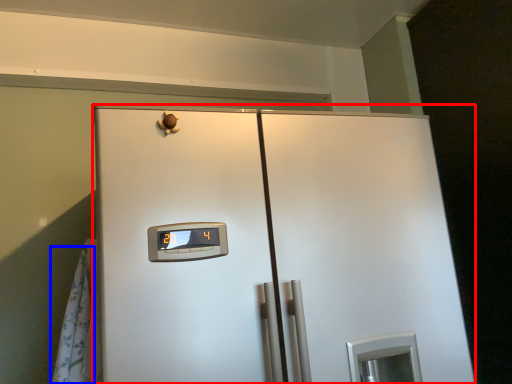
Question: Which of the following is the closest to the observer, refrigerator (highlighted by a red box) or curtain (highlighted by a blue box)?

Choices:
 (A) refrigerator
 (B) curtain

Answer: (A)